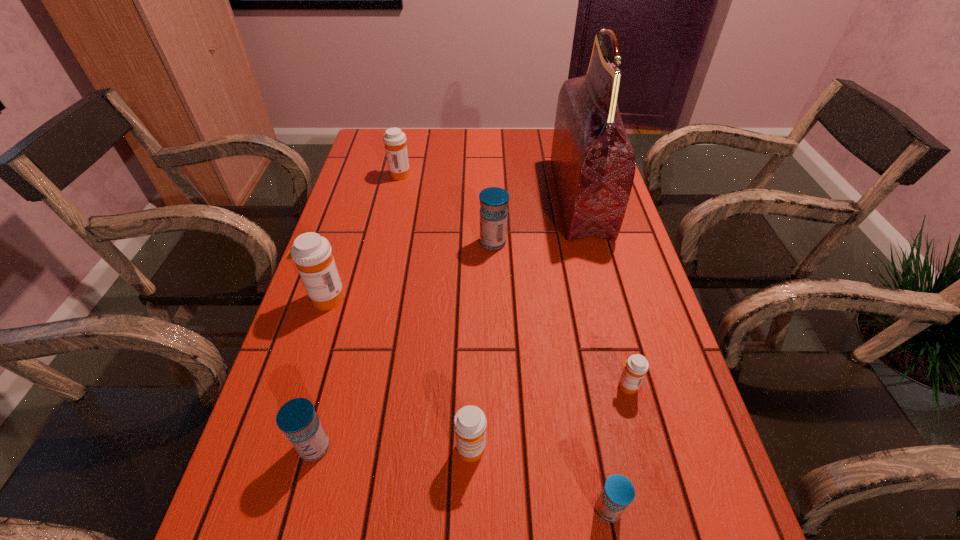
Where is `free spot between the tallest object and the nearest medicine`? This screenshot has width=960, height=540. free spot between the tallest object and the nearest medicine is located at coordinates (593, 353).

Locate an element on the screen. This screenshot has width=960, height=540. empty space between the nearest orange medicine and the second nearest blue medicine is located at coordinates (393, 448).

Locate an element on the screen. The image size is (960, 540). free space between the smallest blue medicine and the farthest medicine is located at coordinates [x=504, y=342].

Locate which object is the sixth closest to the farthest medicine. Please provide its 2D coordinates. Your answer should be formatted as a tuple, i.e. [(x, y)], where the tuple contains the x and y coordinates of a point satisfying the conditions above.

[(636, 366)]

Choose which object is the fourth nearest neighbor to the third biggest orange medicine. Please provide its 2D coordinates. Your answer should be formatted as a tuple, i.e. [(x, y)], where the tuple contains the x and y coordinates of a point satisfying the conditions above.

[(312, 254)]

Where is `medicine that is the fifth closest one to the handbag`? medicine that is the fifth closest one to the handbag is located at coordinates (312, 254).

Locate an element on the screen. medicine identified as the fourth closest to the third object from right to left is located at coordinates (493, 212).

Locate an element on the screen. Image resolution: width=960 pixels, height=540 pixels. orange medicine that stands as the fourth closest to the handbag is located at coordinates (312, 254).

Locate which orange medicine is the fourth closest to the second farthest medicine. Please provide its 2D coordinates. Your answer should be formatted as a tuple, i.e. [(x, y)], where the tuple contains the x and y coordinates of a point satisfying the conditions above.

[(469, 422)]

Identify which blue medicine is the nearest to the leftmost blue medicine. Please provide its 2D coordinates. Your answer should be formatted as a tuple, i.e. [(x, y)], where the tuple contains the x and y coordinates of a point satisfying the conditions above.

[(618, 492)]